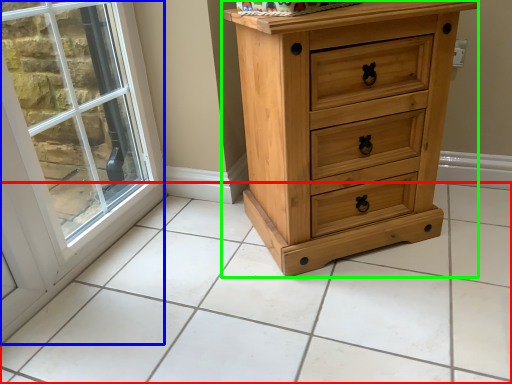
Question: Which object is positioned closest to tile (highlighted by a red box)? Select from window (highlighted by a blue box) and chest of drawers (highlighted by a green box).

Choices:
 (A) window
 (B) chest of drawers

Answer: (B)